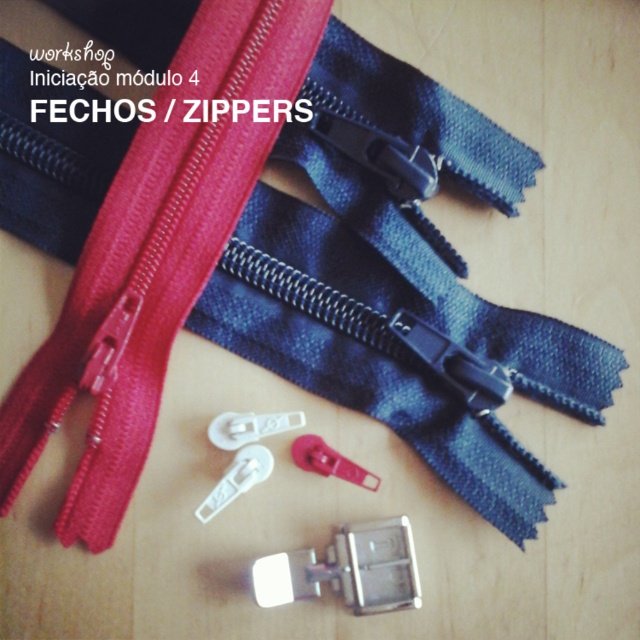
You are a tailor working on a project that requires precise measurements. You have a red matte zipper at center and a matte plastic zipper slider at center. How far apart are these two items?

The distance between the red matte zipper at center and the matte plastic zipper slider at center is 14.07 inches.

In the scene shown: You are designing a layout for a zipper display and need to place a label exactly at the center of the white plastic zipper slider at center. What are the coordinates where you should place the label?

The coordinates for the center of the white plastic zipper slider at center are at point (x=236, y=480).

You are a tailor working on a project that requires precise measurements. You have a red matte zipper at center and a matte plastic zipper slider at center. Which object has a larger width?

The red matte zipper at center is wider than the matte plastic zipper slider at center according to the description provided.